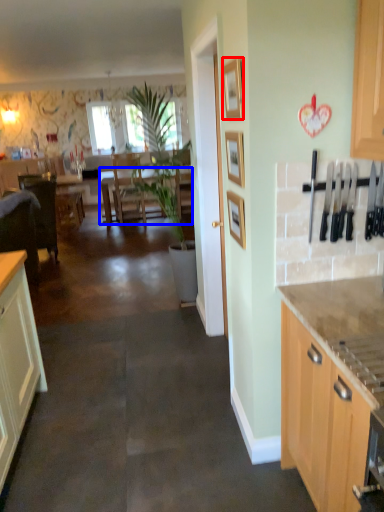
Question: Which object appears farthest to the camera in this image, picture frame (highlighted by a red box) or table (highlighted by a blue box)?

Choices:
 (A) picture frame
 (B) table

Answer: (B)